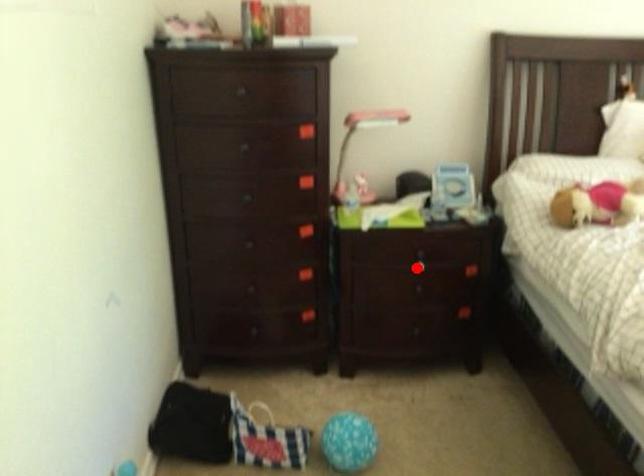
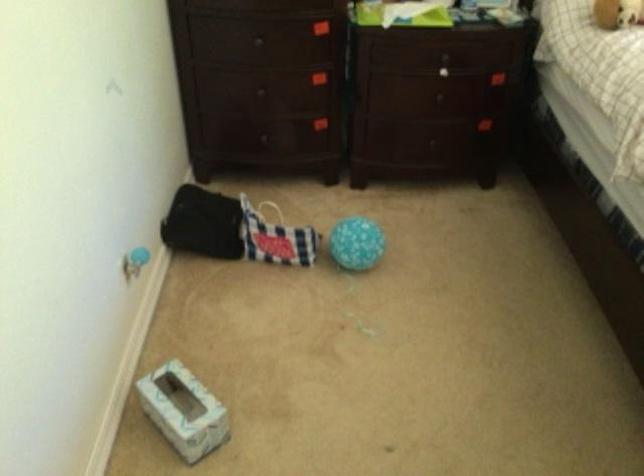
Locate, in the second image, the point that corresponds to the highlighted location in the first image.

(442, 71)